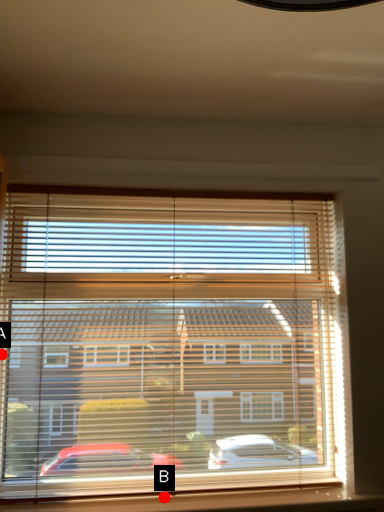
Question: Two points are circled on the image, labeled by A and B beside each circle. Which point appears farthest from the camera in this image?

Choices:
 (A) A is further
 (B) B is further

Answer: (B)